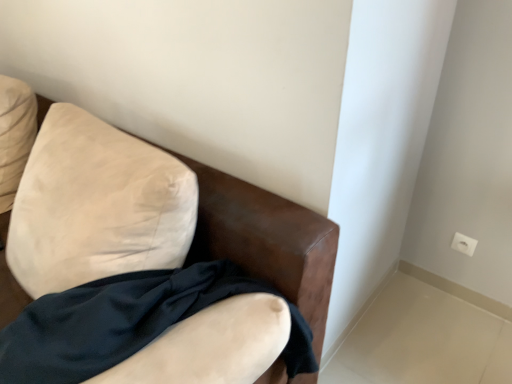
Question: Does white plastic electric outlet at upper right have a larger size compared to satin black fabric at lower left?

Choices:
 (A) no
 (B) yes

Answer: (A)

Question: Is white plastic electric outlet at upper right far away from satin black fabric at lower left?

Choices:
 (A) no
 (B) yes

Answer: (B)

Question: Considering the relative sizes of white plastic electric outlet at upper right and satin black fabric at lower left in the image provided, is white plastic electric outlet at upper right wider than satin black fabric at lower left?

Choices:
 (A) yes
 (B) no

Answer: (B)

Question: From a real-world perspective, is white plastic electric outlet at upper right below satin black fabric at lower left?

Choices:
 (A) no
 (B) yes

Answer: (B)

Question: Is white plastic electric outlet at upper right facing towards satin black fabric at lower left?

Choices:
 (A) yes
 (B) no

Answer: (A)

Question: Is white plastic electric outlet at upper right to the right of satin black fabric at lower left from the viewer's perspective?

Choices:
 (A) yes
 (B) no

Answer: (A)

Question: Is satin black fabric at lower left not inside white plastic electric outlet at upper right?

Choices:
 (A) yes
 (B) no

Answer: (A)

Question: Is satin black fabric at lower left positioned before white plastic electric outlet at upper right?

Choices:
 (A) yes
 (B) no

Answer: (A)

Question: From the image's perspective, would you say satin black fabric at lower left is positioned over white plastic electric outlet at upper right?

Choices:
 (A) no
 (B) yes

Answer: (A)

Question: From the image's perspective, is satin black fabric at lower left below white plastic electric outlet at upper right?

Choices:
 (A) no
 (B) yes

Answer: (B)

Question: Is white plastic electric outlet at upper right located within satin black fabric at lower left?

Choices:
 (A) no
 (B) yes

Answer: (A)

Question: Does satin black fabric at lower left have a greater width compared to white plastic electric outlet at upper right?

Choices:
 (A) no
 (B) yes

Answer: (B)

Question: Is satin black fabric at lower left far from suede-like beige armchair at upper left?

Choices:
 (A) yes
 (B) no

Answer: (B)